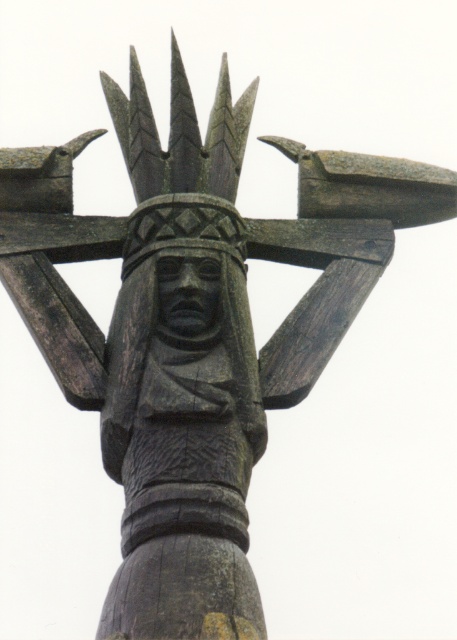
You are an art conservator examining the wooden sculpture. You notice two parts of the sculpture labeled as the carved wood head at center and the dark wood carving at center. Which part is shorter in height?

The carved wood head at center is shorter in height compared to the dark wood carving at center.

You are an art conservator examining the wooden sculpture. You notice two parts of the sculpture, the carved wood head at center and the dark wood carving at center. Which part is closer to your current position?

The carved wood head at center is closer to you than the dark wood carving at center.

Looking at this image, you are an art conservator examining the wooden sculpture. You notice two parts of the sculpture labeled as the carved wood head at center and the dark wood carving at center. Which part has a smaller width?

Answer: The carved wood head at center has a lesser width compared to the dark wood carving at center, so the carved wood head at center is smaller in width.